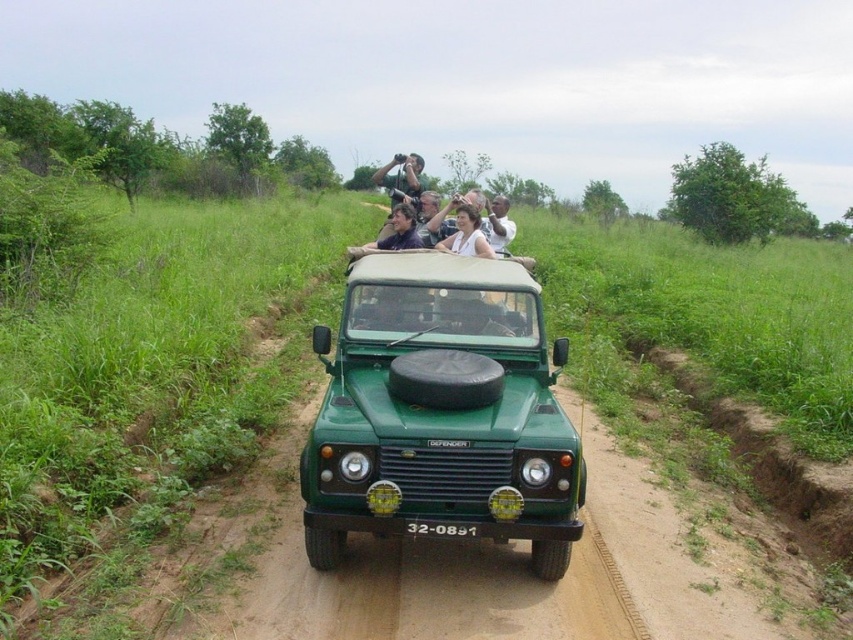
Question: Is white fabric shirt at center further to camera compared to matte black camera at center?

Choices:
 (A) yes
 (B) no

Answer: (B)

Question: Which of the following is the closest to the observer?

Choices:
 (A) matte black shirt at center
 (B) green matte jeep at center
 (C) light brown leather jacket at center
 (D) matte black camera at center

Answer: (B)

Question: Considering the real-world distances, which object is closest to the green matte jeep at center?

Choices:
 (A) white fabric shirt at center
 (B) matte black camera at center
 (C) light brown leather jacket at center

Answer: (A)

Question: Which of the following is the closest to the observer?

Choices:
 (A) (485, 220)
 (B) (364, 477)
 (C) (479, 220)
 (D) (415, 230)

Answer: (B)

Question: Can you confirm if white fabric shirt at center is positioned to the left of matte black camera at center?

Choices:
 (A) yes
 (B) no

Answer: (B)

Question: In this image, where is green matte jeep at center located relative to matte black shirt at center?

Choices:
 (A) below
 (B) above

Answer: (A)